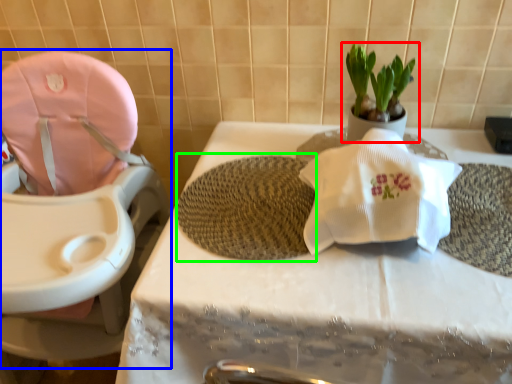
Question: Which object is positioned closest to houseplant (highlighted by a red box)? Select from baby carriage (highlighted by a blue box) and bath mat (highlighted by a green box).

Choices:
 (A) baby carriage
 (B) bath mat

Answer: (B)